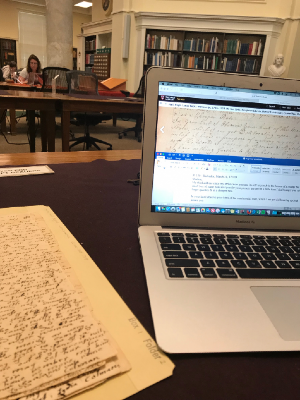
Can you point out all where you'd sit in this image? Your answer should be formatted as a list of tuples, i.e. [(x1, y1), (x2, y2), ...], where each tuple contains the x and y coordinates of a point satisfying the conditions above.

[(85, 82)]